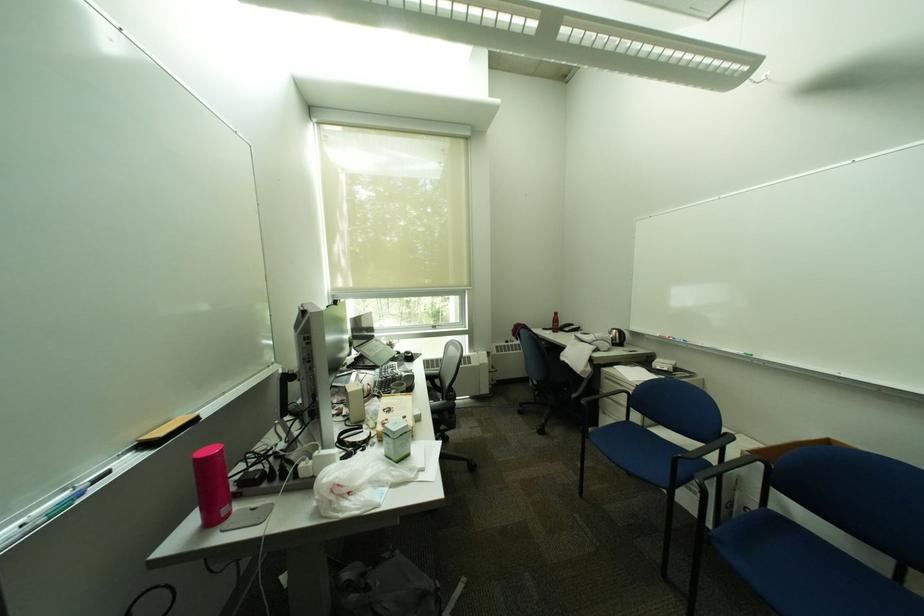
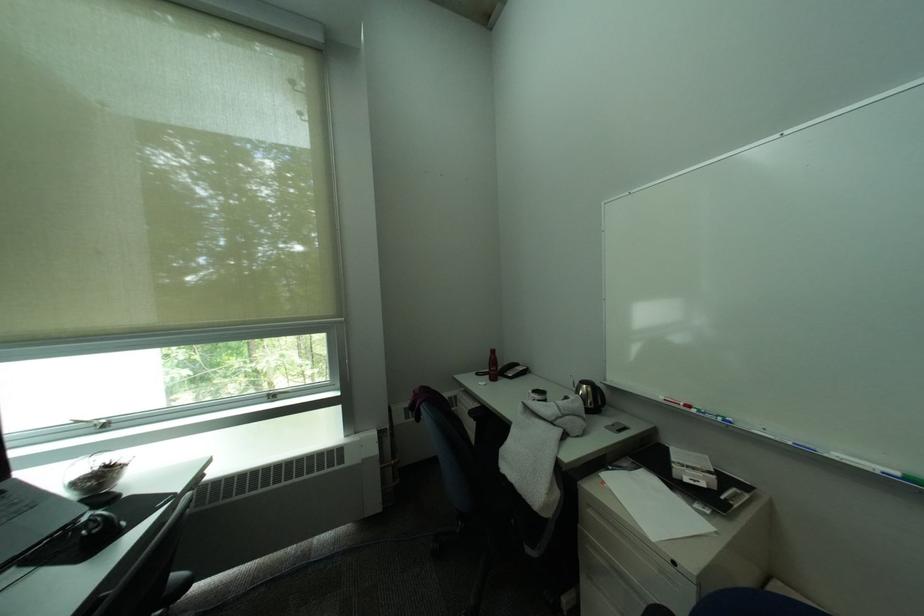
Where in the second image is the point corresponding to (x=687, y=341) from the first image?

(719, 416)